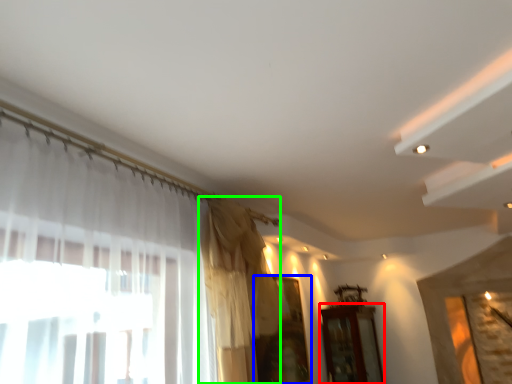
Question: Estimate the real-world distances between objects in this image. Which object is farther from furniture (highlighted by a red box), window (highlighted by a blue box) or curtain (highlighted by a green box)?

Choices:
 (A) window
 (B) curtain

Answer: (B)